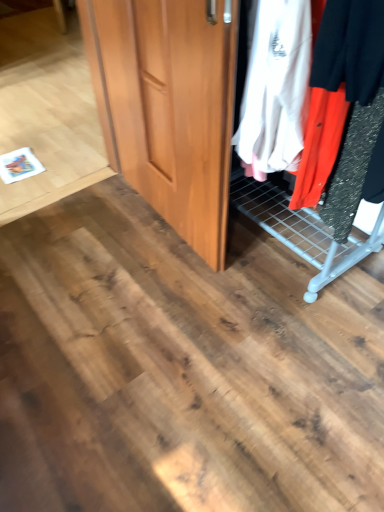
You are a GUI agent. You are given a task and a screenshot of the screen. Output one action in this format:
    pyautogui.click(x=<x>, y=<y>)
    Task: Click on the free space to the left of wooden door at center
    
    Given the screenshot: What is the action you would take?
    pyautogui.click(x=82, y=228)